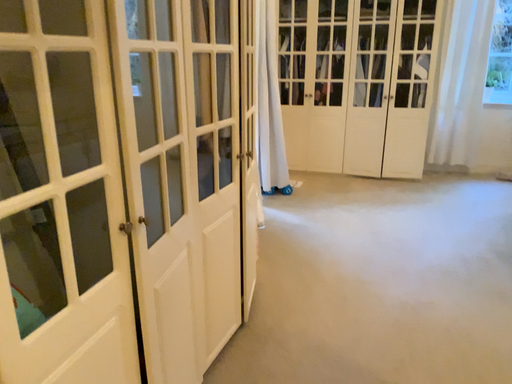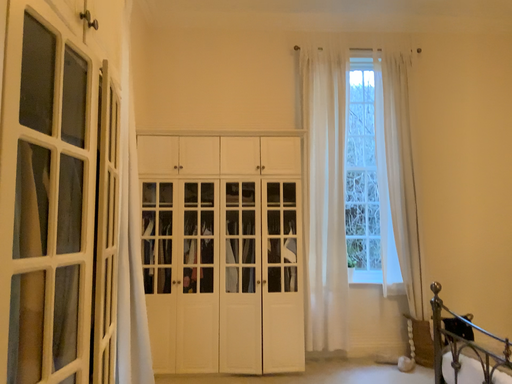
Question: How did the camera likely rotate when shooting the video?

Choices:
 (A) rotated right
 (B) rotated left

Answer: (A)